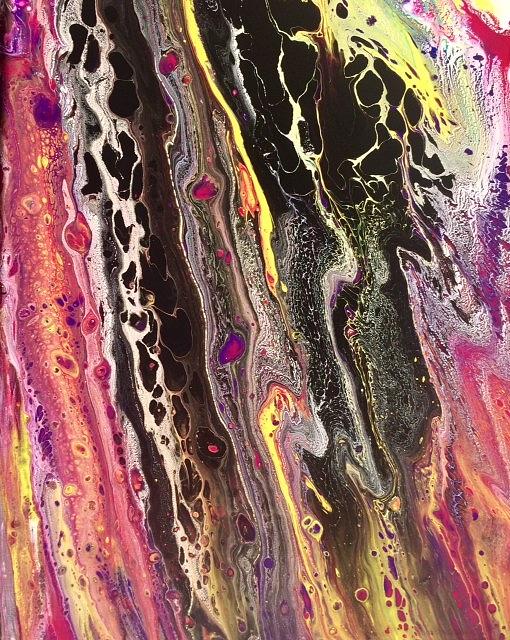
Locate an element on the screen. This screenshot has height=640, width=510. purple paint is located at coordinates (46, 112), (493, 228), (503, 193), (23, 13).